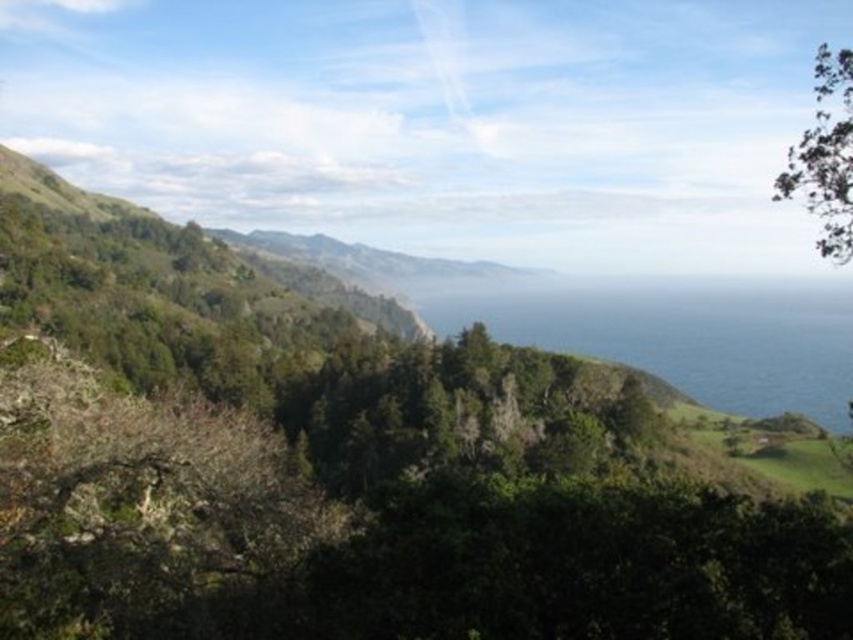
You are a photographer planning to capture the scenic coastal landscape described. You want to ensure that both the blue liquid at center and the green leafy tree at upper right are clearly visible in your shot. Based on their relative sizes in the image, which object should you prioritize positioning closer to the camera to ensure it doesn not get lost in the frame?

The green leafy tree at upper right should be prioritized closer to the camera since the blue liquid at center might be wider than it, making the tree potentially smaller and less prominent in the frame.

You are standing at the camera position and want to reach the point marked at coordinates (825, 420). Given that the distance between you and the point is 391.15 meters, would you need to traverse any significant elevation changes to get there?

The point at (825, 420) is 391.15 meters away from the camera position. Since the terrain in the midground has rugged cliffs dropping towards the sea and the foreground has dense vegetation, you would likely encounter significant elevation changes when moving towards the point.

You are standing on the rugged coastline and want to reach the blue liquid at center. Based on the scene description, which direction should you move relative to your current position?

The blue liquid at center is located at point coordinates, so you should move towards the center of the image to reach it.